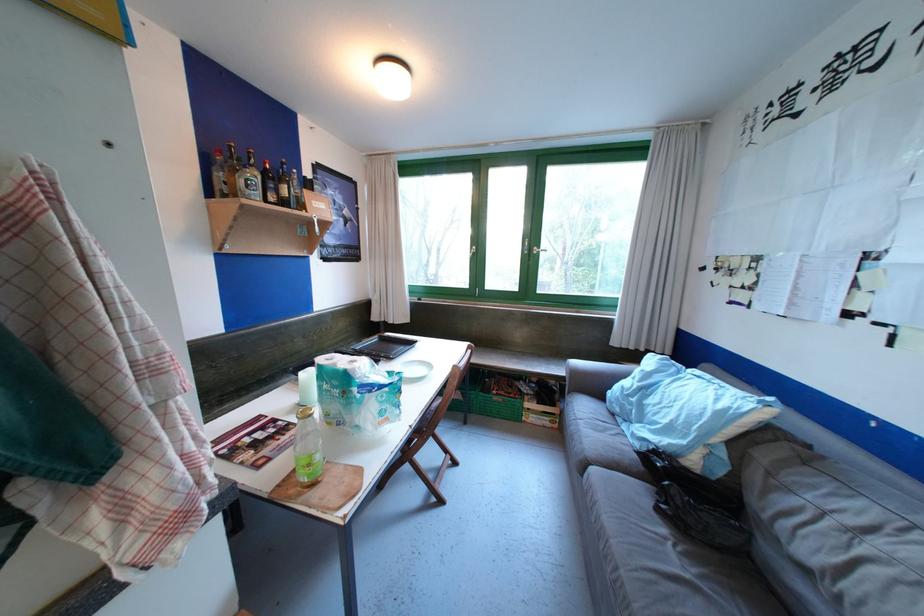
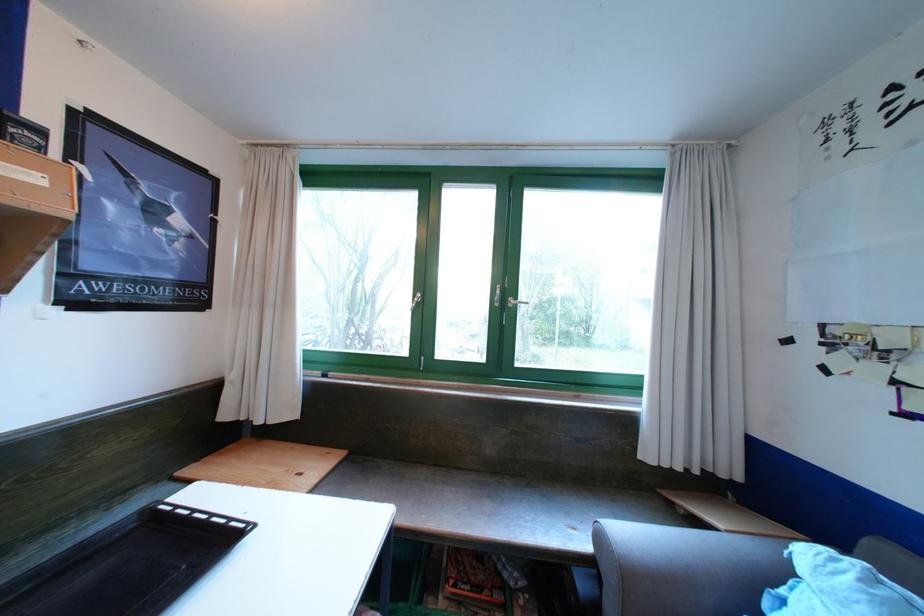
Question: What movement of the cameraman would produce the second image?

Choices:
 (A) Left
 (B) Right
 (C) Forward
 (D) Backward

Answer: (C)